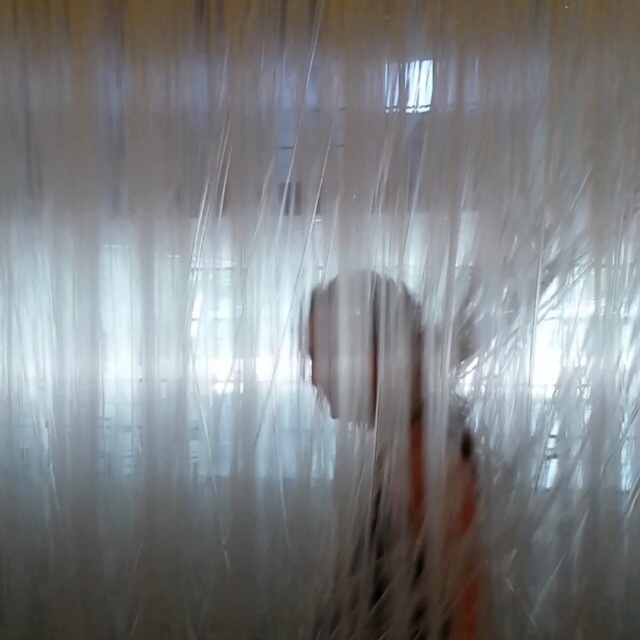
Question: Which point is closer to the camera?

Choices:
 (A) transparent plastic window at upper center
 (B) metallic silver phone at center

Answer: (A)

Question: Does metallic silver phone at center have a smaller size compared to transparent plastic window at upper center?

Choices:
 (A) yes
 (B) no

Answer: (B)

Question: From the image, what is the correct spatial relationship of metallic silver phone at center in relation to transparent plastic window at upper center?

Choices:
 (A) left
 (B) right

Answer: (A)

Question: Among these objects, which one is farthest from the camera?

Choices:
 (A) metallic silver phone at center
 (B) transparent plastic window at upper center

Answer: (A)

Question: Is metallic silver phone at center wider than transparent plastic window at upper center?

Choices:
 (A) yes
 (B) no

Answer: (A)

Question: Which point is closer to the camera?

Choices:
 (A) (416, 372)
 (B) (416, 90)

Answer: (B)